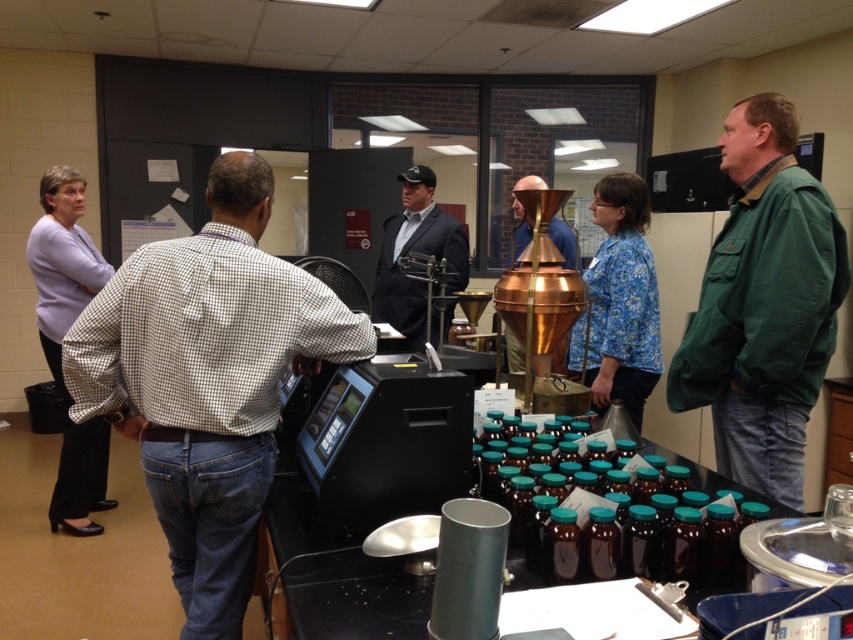
Question: Which point appears farthest from the camera in this image?

Choices:
 (A) (712, 259)
 (B) (99, 259)
 (C) (631, 374)

Answer: (B)

Question: Is light purple fabric shirt at left bigger than copper metallic brewing apparatus at center?

Choices:
 (A) no
 (B) yes

Answer: (B)

Question: Which point is farther to the camera?

Choices:
 (A) (282, 321)
 (B) (527, 237)
 (C) (73, 452)
 (D) (596, 346)

Answer: (B)

Question: In this image, where is blue floral shirt at center located relative to black suit at center?

Choices:
 (A) left
 (B) right

Answer: (B)

Question: Which object is positioned farthest from the light purple fabric shirt at left?

Choices:
 (A) white checkered shirt at center
 (B) green cotton jacket at right
 (C) blue floral shirt at center
 (D) black suit at center

Answer: (B)

Question: Is green cotton jacket at right below light purple fabric shirt at left?

Choices:
 (A) no
 (B) yes

Answer: (A)